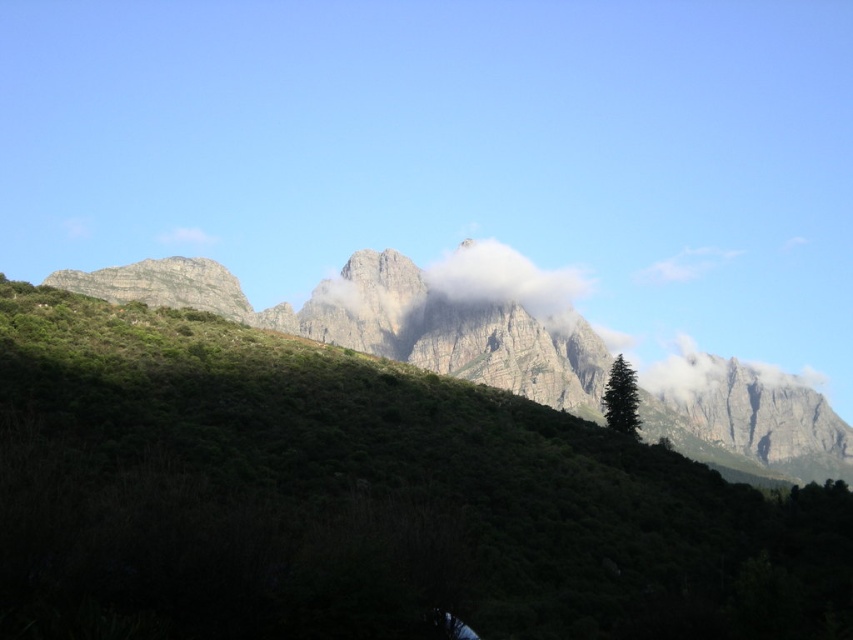
Question: Which point is farther from the camera taking this photo?

Choices:
 (A) (x=457, y=252)
 (B) (x=206, y=356)

Answer: (A)

Question: Can you confirm if green textured hillside at center is positioned above white fluffy cloud at center?

Choices:
 (A) no
 (B) yes

Answer: (A)

Question: Does green textured hillside at center appear over white fluffy cloud at center?

Choices:
 (A) no
 (B) yes

Answer: (A)

Question: Which point is farther to the camera?

Choices:
 (A) green textured hillside at center
 (B) white fluffy cloud at center

Answer: (B)

Question: Is green textured hillside at center below white fluffy cloud at center?

Choices:
 (A) yes
 (B) no

Answer: (A)